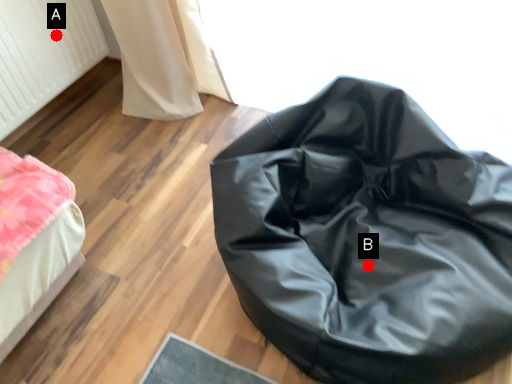
Question: Two points are circled on the image, labeled by A and B beside each circle. Which point appears farthest from the camera in this image?

Choices:
 (A) A is further
 (B) B is further

Answer: (A)